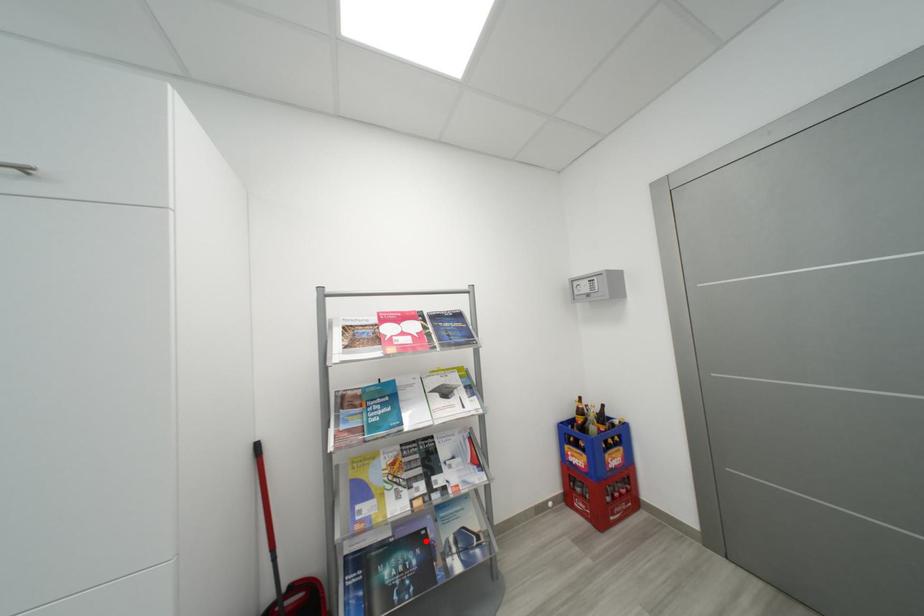
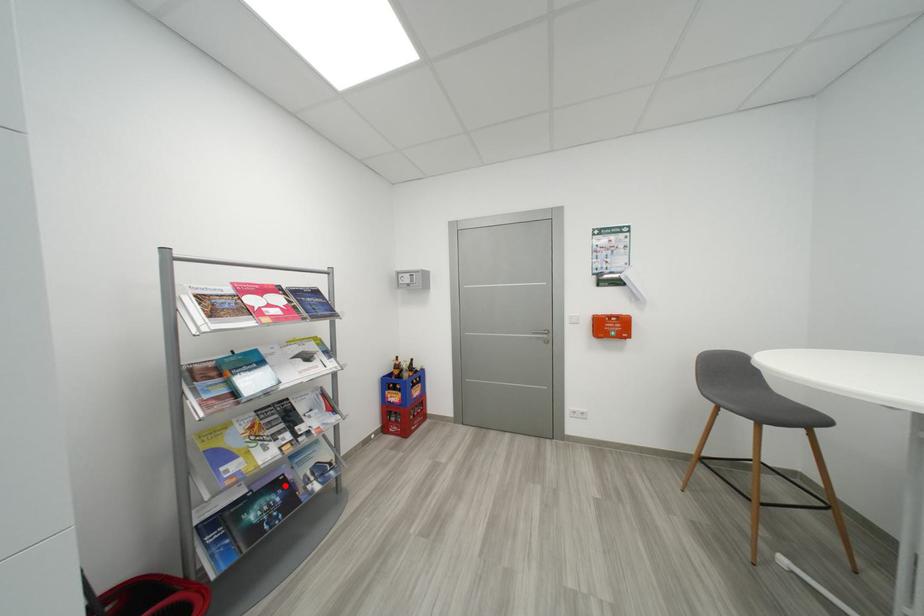
I am providing you with two images of the same scene from different viewpoints. A red point is marked on the first image and another point is marked on the second image. Do the highlighted points in image1 and image2 indicate the same real-world spot?

Yes